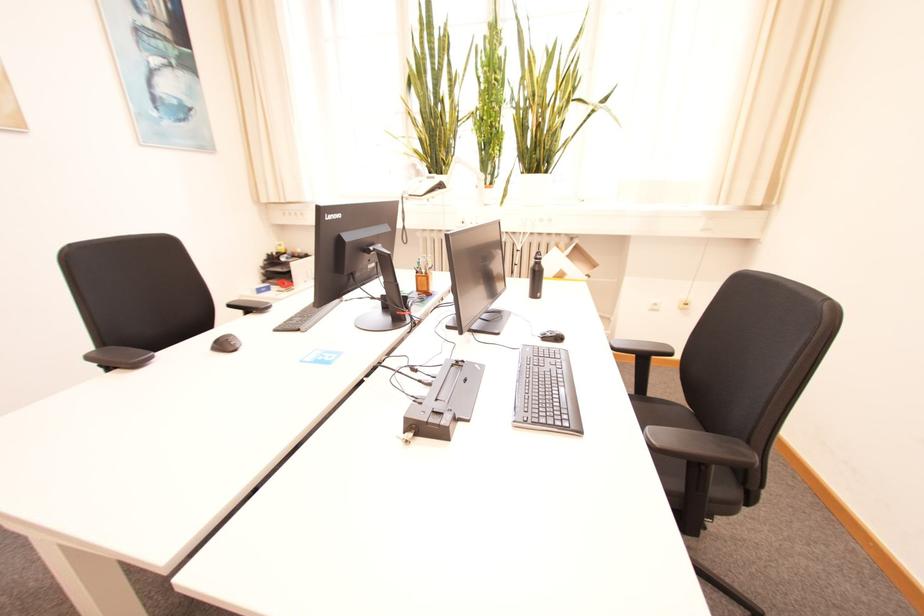
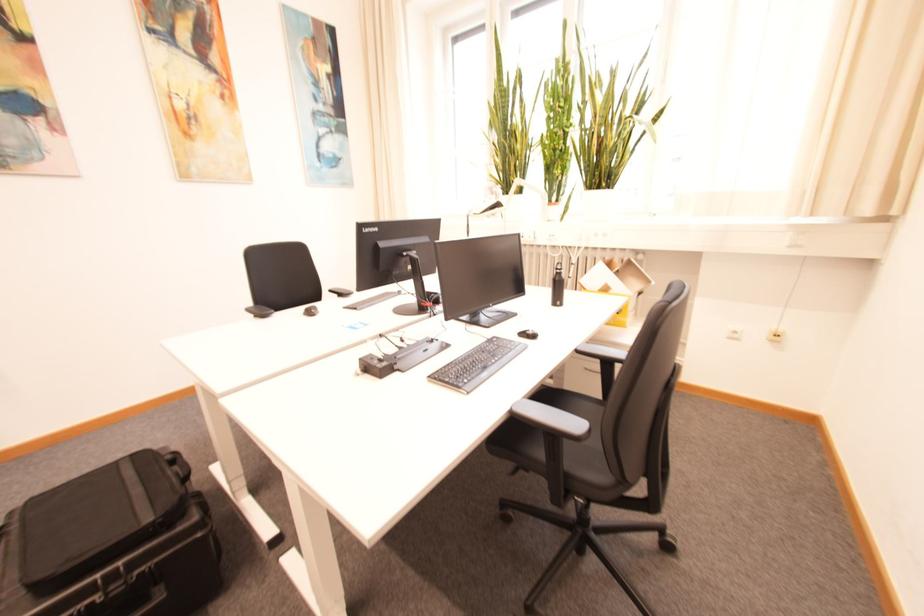
Question: What movement of the cameraman would produce the second image?

Choices:
 (A) Left
 (B) Right
 (C) Forward
 (D) Backward

Answer: (B)